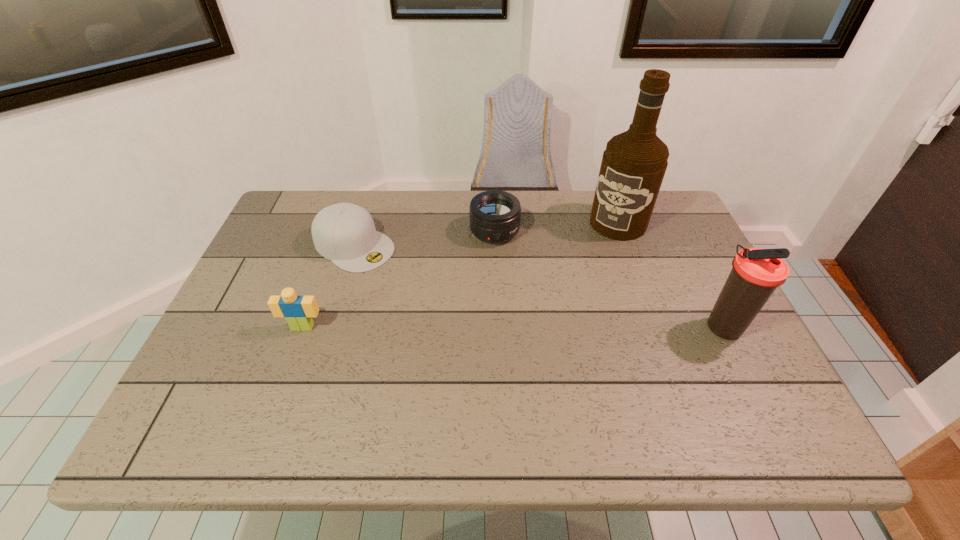
Identify the location of alcohol situated at the far edge. (633, 166).

Identify the location of Lego present at the left edge. (298, 311).

I want to click on cap that is at the left edge, so click(x=345, y=233).

Where is `thermos bottle located in the right edge section of the desktop`? This screenshot has height=540, width=960. thermos bottle located in the right edge section of the desktop is located at coordinates [x=756, y=273].

Image resolution: width=960 pixels, height=540 pixels. What are the coordinates of `alcohol that is at the right edge` in the screenshot? It's located at (633, 166).

You are a GUI agent. You are given a task and a screenshot of the screen. Output one action in this format:
    pyautogui.click(x=<x>, y=<y>)
    Task: Click on the object that is at the far left corner
    
    Given the screenshot: What is the action you would take?
    pyautogui.click(x=345, y=233)

At what (x,y) coordinates should I click in order to perform the action: click on object positioned at the far right corner. Please return your answer as a coordinate pair (x, y). Image resolution: width=960 pixels, height=540 pixels. Looking at the image, I should click on (633, 166).

In the image, there is a desktop. Where is `free region at the far edge`? The width and height of the screenshot is (960, 540). free region at the far edge is located at coordinates (550, 194).

You are a GUI agent. You are given a task and a screenshot of the screen. Output one action in this format:
    pyautogui.click(x=<x>, y=<y>)
    Task: Click on the blank space at the near edge of the desktop
    This screenshot has height=540, width=960.
    Given the screenshot: What is the action you would take?
    pyautogui.click(x=477, y=378)

Where is `vacant space at the left edge of the desktop`? This screenshot has height=540, width=960. vacant space at the left edge of the desktop is located at coordinates (282, 252).